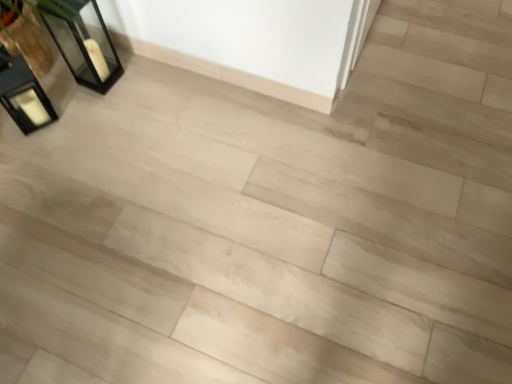
The height and width of the screenshot is (384, 512). Describe the element at coordinates (25, 97) in the screenshot. I see `matte black lantern at left` at that location.

This screenshot has width=512, height=384. I want to click on matte black lantern at left, so click(25, 97).

Where is `matte black lantern at left`? The image size is (512, 384). matte black lantern at left is located at coordinates (25, 97).